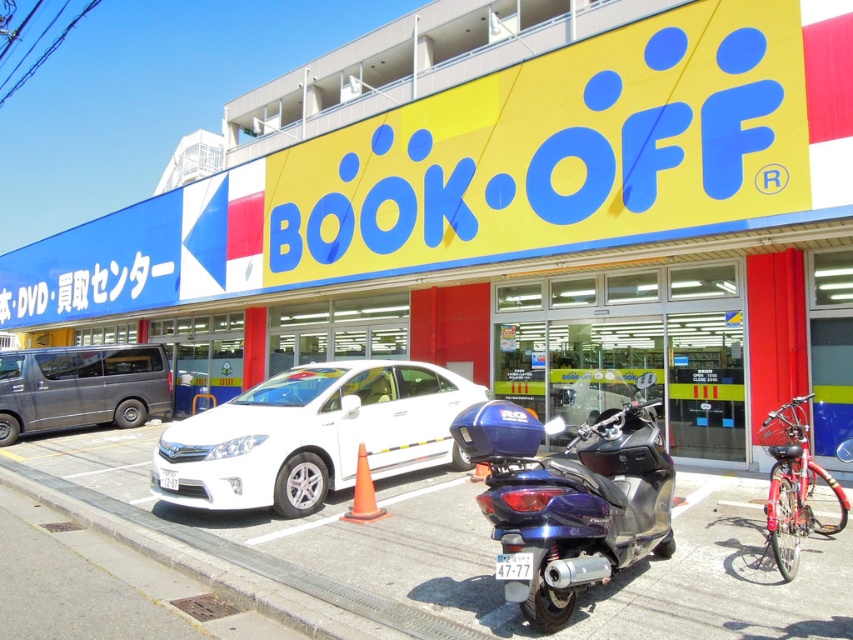
Question: Is white glossy sedan at center to the right of orange matte cone at center from the viewer's perspective?

Choices:
 (A) no
 (B) yes

Answer: (A)

Question: Can you confirm if white glossy sedan at center is smaller than silver metallic van at left?

Choices:
 (A) yes
 (B) no

Answer: (A)

Question: Which object is positioned farthest from the white glossy sedan at center?

Choices:
 (A) silver metallic van at left
 (B) orange matte cone at center
 (C) metallic blue scooter at center

Answer: (A)

Question: Does white glossy sedan at center appear under orange matte cone at center?

Choices:
 (A) yes
 (B) no

Answer: (B)

Question: Which of the following is the closest to the observer?

Choices:
 (A) orange matte cone at center
 (B) white glossy sedan at center

Answer: (B)

Question: Which point is farther from the camera taking this photo?

Choices:
 (A) (370, 449)
 (B) (24, 422)
 (C) (485, 456)
 (D) (374, 496)

Answer: (B)